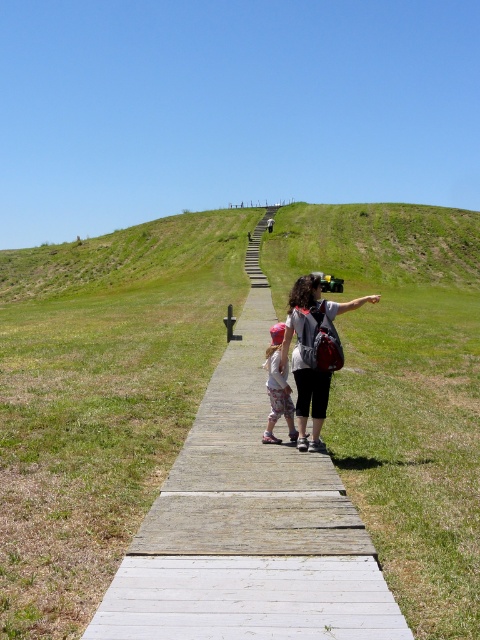
Can you confirm if green grassy hillside at upper center is smaller than floral-patterned dress at center?

Incorrect, green grassy hillside at upper center is not smaller in size than floral-patterned dress at center.

Does point (364, 209) come farther from viewer compared to point (289, 435)?

That is True.

Is point (374, 244) less distant than point (276, 365)?

That is False.

I want to click on green grassy hillside at upper center, so click(376, 243).

Based on the photo, between matte gray backpack at center and floral-patterned dress at center, which one has more height?

With more height is matte gray backpack at center.

Can you confirm if matte gray backpack at center is positioned below floral-patterned dress at center?

Incorrect, matte gray backpack at center is not positioned below floral-patterned dress at center.

Which is behind, point (315, 300) or point (284, 380)?

The point (284, 380) is behind.

Identify the location of matte gray backpack at center. (313, 352).

Who is more forward, (x=194, y=490) or (x=178, y=240)?

Point (x=194, y=490)

Does point (349, 577) lie in front of point (425, 278)?

Yes, point (349, 577) is closer to viewer.

Does point (319, 595) come behind point (323, 221)?

No.

Where is `wooden boardwalk at center`? The width and height of the screenshot is (480, 640). wooden boardwalk at center is located at coordinates (248, 525).